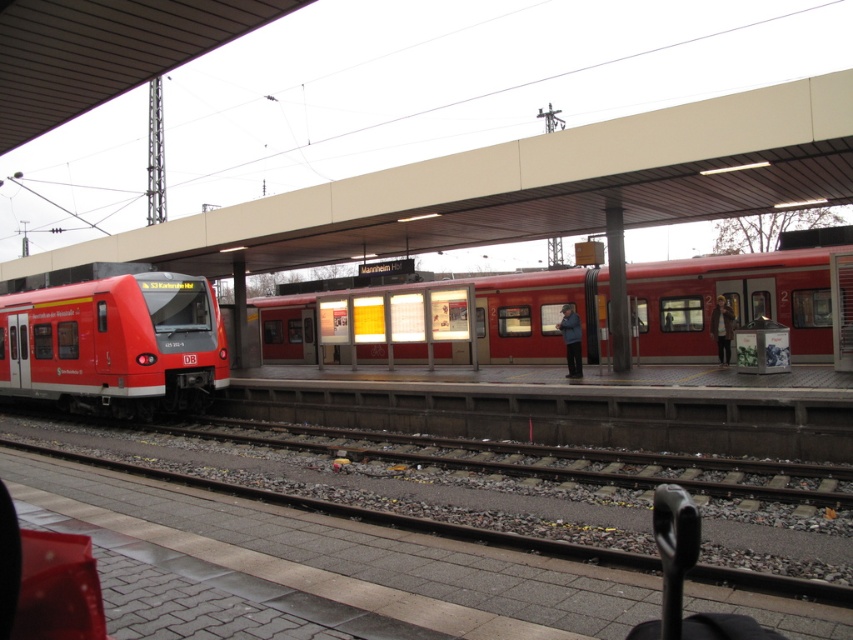
Who is more distant from viewer, (x=711, y=314) or (x=171, y=330)?

Positioned behind is point (x=711, y=314).

Which is behind, point (364, 301) or point (213, 326)?

Point (364, 301)

Locate an element on the screen. matte red train at center is located at coordinates (729, 301).